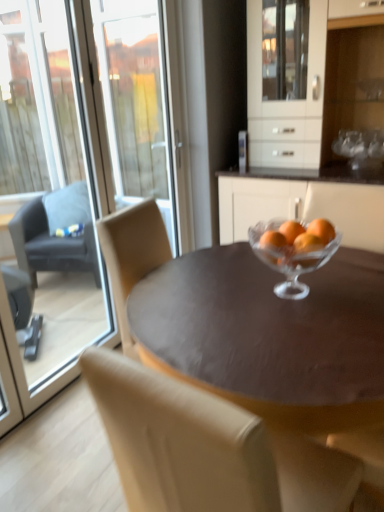
Image resolution: width=384 pixels, height=512 pixels. In order to click on vacant area on top of matte brown table at center (from a real-world perspective) in this screenshot , I will do `click(260, 301)`.